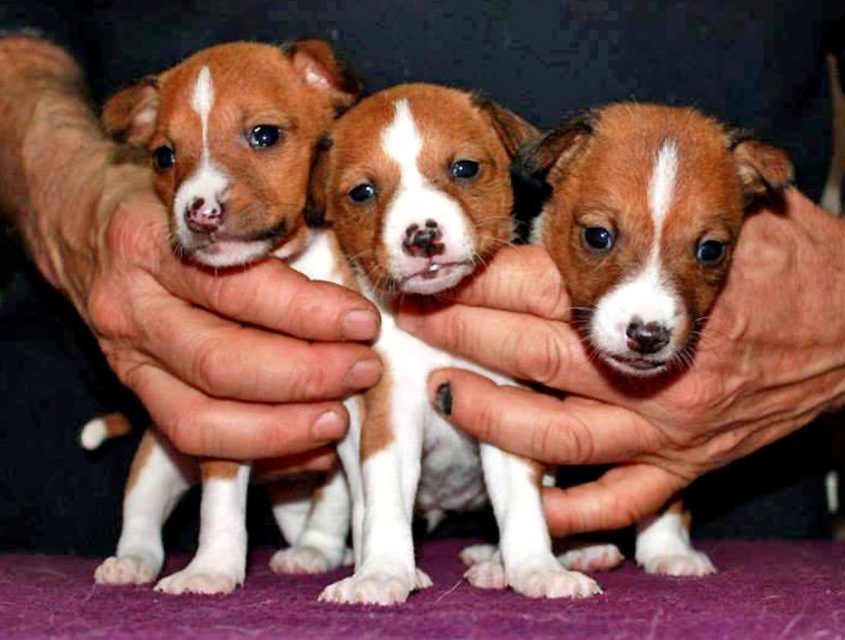
Based on the scene description, where is the smooth skin hand at center located in the image? Please provide the coordinates as a point in the format of a tuple with two decimal numbers between 0 and 1, where the first number represents the horizontal axis and the second number represents the vertical axis. For example, a point in the center would be written as 0.5,0.5. The answer should be the coordinate point in the format of a tuple with two decimal numbers between 0 and 1, where the first number is the

The smooth skin hand at center is located at the coordinates point (642, 378).

You are a photographer taking a picture of the brown furry puppy at center. The smooth skin hand at left is blocking your view. Can you move the hand to the right to get a clear shot of the puppy?

The smooth skin hand at left is currently positioned to the left of the brown furry puppy at center. Moving the hand to the right would allow it to no longer block the view of the puppy, so yes, moving the hand to the right would help get a clear shot of the brown furry puppy at center.

You are a veterinarian examining two hands holding puppies in the image. The smooth skin hand at center is holding one puppy, and the smooth skin hand at left is holding another. Which hand has a thinner shape?

The smooth skin hand at center is thinner than the smooth skin hand at left, so the smooth skin hand at center has a thinner shape.